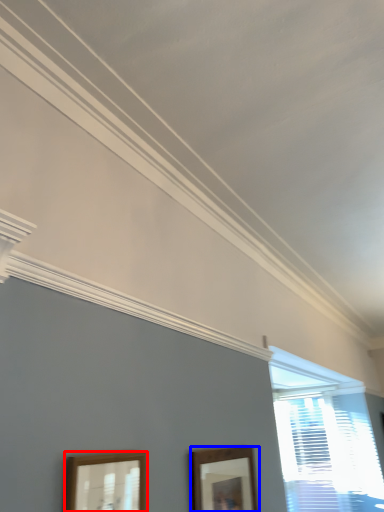
Question: Which of the following is the closest to the observer, picture frame (highlighted by a red box) or picture frame (highlighted by a blue box)?

Choices:
 (A) picture frame
 (B) picture frame

Answer: (A)